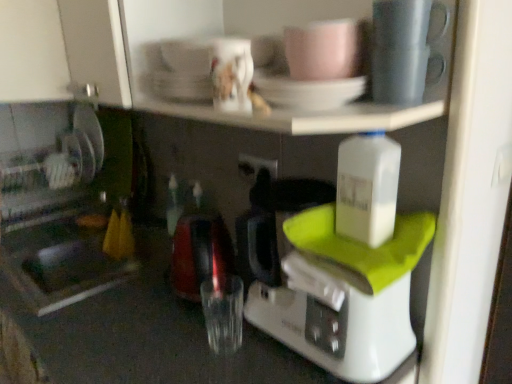
The width and height of the screenshot is (512, 384). Find the location of `matte gray mug at upper right, the second tableware positioned from the left`. matte gray mug at upper right, the second tableware positioned from the left is located at coordinates (399, 73).

Find the location of a particular element. The height and width of the screenshot is (384, 512). pink matte mug at upper center, positioned as the second coffee cup in left-to-right order is located at coordinates (323, 50).

Describe the element at coordinates (367, 188) in the screenshot. Image resolution: width=512 pixels, height=384 pixels. I see `white plastic bottle at center-right` at that location.

What is the approximate width of white plastic bottle at center-right?

white plastic bottle at center-right is 5.50 inches wide.

What is the approximate width of matte ceramic mug at upper center, positioned as the second tableware in right-to-left order?

7.26 inches.

The height and width of the screenshot is (384, 512). Identify the location of black plastic electric outlet at center. (255, 166).

Describe the element at coordinates (232, 75) in the screenshot. I see `porcelain white coffee cup at upper center, the first coffee cup in the left-to-right sequence` at that location.

Image resolution: width=512 pixels, height=384 pixels. Identify the location of matte gray mug at upper right, which is the 1th tableware in right-to-left order. (399, 73).

Is black plastic electric outlet at center outside of porcelain white coffee cup at upper center, the first coffee cup in the left-to-right sequence?

black plastic electric outlet at center is positioned outside porcelain white coffee cup at upper center, the first coffee cup in the left-to-right sequence.

In the image, is black plastic electric outlet at center on the left side or the right side of porcelain white coffee cup at upper center, the first coffee cup in the left-to-right sequence?

black plastic electric outlet at center is positioned on porcelain white coffee cup at upper center, the first coffee cup in the left-to-right sequence,'s right side.

Is black plastic electric outlet at center facing away from porcelain white coffee cup at upper center, the 2th coffee cup positioned from the right?

No.

In the image, is black plastic electric outlet at center positioned in front of or behind porcelain white coffee cup at upper center, the first coffee cup in the left-to-right sequence?

black plastic electric outlet at center is behind porcelain white coffee cup at upper center, the first coffee cup in the left-to-right sequence.

Considering the relative positions of porcelain white coffee cup at upper center, the first coffee cup in the left-to-right sequence, and white plastic coffee maker at center in the image provided, is porcelain white coffee cup at upper center, the first coffee cup in the left-to-right sequence, to the left or to the right of white plastic coffee maker at center?

porcelain white coffee cup at upper center, the first coffee cup in the left-to-right sequence, is to the left of white plastic coffee maker at center.

Identify the location of coffee maker in front of the porcelain white coffee cup at upper center, the 2th coffee cup positioned from the right. (344, 296).

Which object is closer to the camera, porcelain white coffee cup at upper center, the 2th coffee cup positioned from the right, or white plastic coffee maker at center?

white plastic coffee maker at center is more forward.

Is porcelain white coffee cup at upper center, the 2th coffee cup positioned from the right, aimed at white plastic coffee maker at center?

No, porcelain white coffee cup at upper center, the 2th coffee cup positioned from the right, does not turn towards white plastic coffee maker at center.

There is a matte ceramic mug at upper center, positioned as the second tableware in right-to-left order. Where is `tableware above it (from a real-world perspective)`? The image size is (512, 384). tableware above it (from a real-world perspective) is located at coordinates (399, 73).

Considering the positions of objects matte ceramic mug at upper center, positioned as the second tableware in right-to-left order, and matte gray mug at upper right, the second tableware positioned from the left, in the image provided, who is in front, matte ceramic mug at upper center, positioned as the second tableware in right-to-left order, or matte gray mug at upper right, the second tableware positioned from the left,?

matte gray mug at upper right, the second tableware positioned from the left, is closer to the camera.

Considering the sizes of objects matte ceramic mug at upper center, the first tableware in the left-to-right sequence, and matte gray mug at upper right, which is the 1th tableware in right-to-left order, in the image provided, who is taller, matte ceramic mug at upper center, the first tableware in the left-to-right sequence, or matte gray mug at upper right, which is the 1th tableware in right-to-left order,?

matte gray mug at upper right, which is the 1th tableware in right-to-left order, is taller.

Is black plastic electric outlet at center positioned behind matte ceramic mug at upper center, positioned as the second tableware in right-to-left order?

Yes, black plastic electric outlet at center is further from the camera.

Find the location of `electric outlet behind the matte ceramic mug at upper center, the first tableware in the left-to-right sequence`. electric outlet behind the matte ceramic mug at upper center, the first tableware in the left-to-right sequence is located at coordinates (255, 166).

Is black plastic electric outlet at center wider or thinner than matte ceramic mug at upper center, the first tableware in the left-to-right sequence?

black plastic electric outlet at center is thinner than matte ceramic mug at upper center, the first tableware in the left-to-right sequence.

Which object is positioned more to the left, black plastic electric outlet at center or matte ceramic mug at upper center, the first tableware in the left-to-right sequence?

black plastic electric outlet at center is more to the left.

Considering the relative positions of pink matte mug at upper center, placed as the first coffee cup when sorted from right to left, and matte gray mug at upper right, which is the 1th tableware in right-to-left order, in the image provided, is pink matte mug at upper center, placed as the first coffee cup when sorted from right to left, to the right of matte gray mug at upper right, which is the 1th tableware in right-to-left order, from the viewer's perspective?

In fact, pink matte mug at upper center, placed as the first coffee cup when sorted from right to left, is to the left of matte gray mug at upper right, which is the 1th tableware in right-to-left order.

Starting from the matte gray mug at upper right, which is the 1th tableware in right-to-left order, which coffee cup is the 1st one to the left? Please provide its 2D coordinates.

[(323, 50)]

Is pink matte mug at upper center, positioned as the second coffee cup in left-to-right order, behind matte gray mug at upper right, which is the 1th tableware in right-to-left order?

Yes, it is.

Who is taller, pink matte mug at upper center, placed as the first coffee cup when sorted from right to left, or matte gray mug at upper right, which is the 1th tableware in right-to-left order?

Standing taller between the two is pink matte mug at upper center, placed as the first coffee cup when sorted from right to left.

How much distance is there between white plastic bottle at center-right and black plastic electric outlet at center?

14.17 inches.

Is white plastic bottle at center-right facing away from black plastic electric outlet at center?

That's not correct — white plastic bottle at center-right is not looking away from black plastic electric outlet at center.

From their relative heights in the image, would you say white plastic bottle at center-right is taller or shorter than black plastic electric outlet at center?

In the image, white plastic bottle at center-right appears to be taller than black plastic electric outlet at center.

From a real-world perspective, is white plastic bottle at center-right physically below black plastic electric outlet at center?

No.

Looking at this image, is pink matte mug at upper center, positioned as the second coffee cup in left-to-right order, taller or shorter than porcelain white coffee cup at upper center, the 2th coffee cup positioned from the right?

In the image, pink matte mug at upper center, positioned as the second coffee cup in left-to-right order, appears to be shorter than porcelain white coffee cup at upper center, the 2th coffee cup positioned from the right.

Looking at this image, does pink matte mug at upper center, positioned as the second coffee cup in left-to-right order, appear on the left side of porcelain white coffee cup at upper center, the first coffee cup in the left-to-right sequence?

No, pink matte mug at upper center, positioned as the second coffee cup in left-to-right order, is not to the left of porcelain white coffee cup at upper center, the first coffee cup in the left-to-right sequence.

From the image's perspective, which one is positioned higher, pink matte mug at upper center, positioned as the second coffee cup in left-to-right order, or porcelain white coffee cup at upper center, the 2th coffee cup positioned from the right?

pink matte mug at upper center, positioned as the second coffee cup in left-to-right order, from the image's perspective.

Find the location of a particular element. coffee cup to the left of black plastic electric outlet at center is located at coordinates (232, 75).

In order to click on the 2nd coffee cup behind the white plastic coffee maker at center in this screenshot , I will do `click(232, 75)`.

Which object lies further to the anchor point matte ceramic mug at upper center, positioned as the second tableware in right-to-left order, matte gray mug at upper right, the second tableware positioned from the left, or porcelain white coffee cup at upper center, the first coffee cup in the left-to-right sequence?

matte gray mug at upper right, the second tableware positioned from the left, is further to matte ceramic mug at upper center, positioned as the second tableware in right-to-left order.

Estimate the real-world distances between objects in this image. Which object is further from pink matte mug at upper center, positioned as the second coffee cup in left-to-right order, white plastic bottle at center-right or porcelain white coffee cup at upper center, the 2th coffee cup positioned from the right?

The object further to pink matte mug at upper center, positioned as the second coffee cup in left-to-right order, is white plastic bottle at center-right.

Considering their positions, is pink matte mug at upper center, placed as the first coffee cup when sorted from right to left, positioned further to porcelain white coffee cup at upper center, the 2th coffee cup positioned from the right, than matte gray mug at upper right, the second tableware positioned from the left?

matte gray mug at upper right, the second tableware positioned from the left, is positioned further to the anchor porcelain white coffee cup at upper center, the 2th coffee cup positioned from the right.

Based on their spatial positions, is white plastic bottle at center-right or pink matte mug at upper center, placed as the first coffee cup when sorted from right to left, closer to black plastic electric outlet at center?

The object closer to black plastic electric outlet at center is white plastic bottle at center-right.

Which object lies nearer to the anchor point matte ceramic mug at upper center, positioned as the second tableware in right-to-left order, porcelain white coffee cup at upper center, the 2th coffee cup positioned from the right, or black plastic electric outlet at center?

porcelain white coffee cup at upper center, the 2th coffee cup positioned from the right, is positioned closer to the anchor matte ceramic mug at upper center, positioned as the second tableware in right-to-left order.

When comparing their distances from porcelain white coffee cup at upper center, the 2th coffee cup positioned from the right, does black plastic electric outlet at center or matte ceramic mug at upper center, the first tableware in the left-to-right sequence, seem further?

Among the two, black plastic electric outlet at center is located further to porcelain white coffee cup at upper center, the 2th coffee cup positioned from the right.

Looking at the image, which one is located closer to pink matte mug at upper center, placed as the first coffee cup when sorted from right to left, matte ceramic mug at upper center, positioned as the second tableware in right-to-left order, or white plastic coffee maker at center?

matte ceramic mug at upper center, positioned as the second tableware in right-to-left order, is closer to pink matte mug at upper center, placed as the first coffee cup when sorted from right to left.

When comparing their distances from white plastic coffee maker at center, does matte ceramic mug at upper center, positioned as the second tableware in right-to-left order, or matte gray mug at upper right, the second tableware positioned from the left, seem further?

matte gray mug at upper right, the second tableware positioned from the left, lies further to white plastic coffee maker at center than the other object.

Find the location of a particular element. This screenshot has width=512, height=384. coffee cup between pink matte mug at upper center, placed as the first coffee cup when sorted from right to left, and black plastic electric outlet at center from front to back is located at coordinates (232, 75).

The height and width of the screenshot is (384, 512). What are the coordinates of `coffee cup located between porcelain white coffee cup at upper center, the 2th coffee cup positioned from the right, and white plastic bottle at center-right in the left-right direction` in the screenshot? It's located at (323, 50).

Where is `tableware between matte gray mug at upper right, the second tableware positioned from the left, and black plastic electric outlet at center from front to back`? The height and width of the screenshot is (384, 512). tableware between matte gray mug at upper right, the second tableware positioned from the left, and black plastic electric outlet at center from front to back is located at coordinates (307, 91).

Locate an element on the screen. This screenshot has width=512, height=384. coffee cup between white plastic bottle at center-right and black plastic electric outlet at center from front to back is located at coordinates (232, 75).